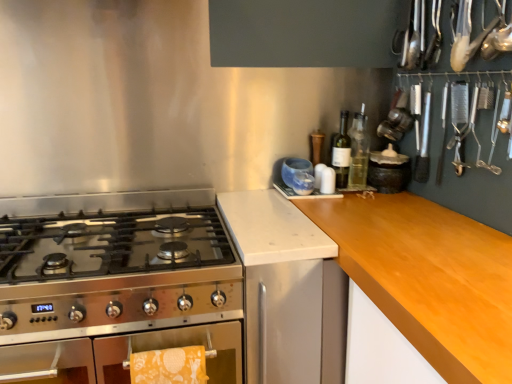
What is the approximate width of matte black jar at upper right?

4.41 inches.

In order to face matte black jar at upper right, should I rotate leftwards or rightwards?

Rotate right and turn 17.302 degrees.

This screenshot has height=384, width=512. I want to click on green glass bottle at upper right, which appears as the 1th bottle when viewed from the left, so coord(341,152).

What do you see at coordinates (117, 281) in the screenshot? The height and width of the screenshot is (384, 512). I see `stainless steel gas stove at left` at bounding box center [117, 281].

How much space does clear glass bottle at upper right, marked as the first bottle in a right-to-left arrangement, occupy horizontally?

It is 3.05 inches.

In order to face clear glass bottle at upper right, the 2th bottle in the left-to-right sequence, should I rotate leftwards or rightwards?

You should look right and rotate roughly 13.727 degrees.

What are the coordinates of `yellow printed towel at lower left` in the screenshot? It's located at (169, 366).

Is clear glass bottle at upper right, the 2th bottle in the left-to-right sequence, at the back of matte black jar at upper right?

Yes, matte black jar at upper right is facing away from clear glass bottle at upper right, the 2th bottle in the left-to-right sequence.

Would you say matte black jar at upper right is a long distance from clear glass bottle at upper right, marked as the first bottle in a right-to-left arrangement?

No, matte black jar at upper right is not far away from clear glass bottle at upper right, marked as the first bottle in a right-to-left arrangement.

From the image's perspective, is matte black jar at upper right positioned above or below clear glass bottle at upper right, marked as the first bottle in a right-to-left arrangement?

matte black jar at upper right is below clear glass bottle at upper right, marked as the first bottle in a right-to-left arrangement.

From a real-world perspective, count 1st bottles upward from the stainless steel gas stove at left and point to it. Please provide its 2D coordinates.

[(358, 152)]

Which is correct: stainless steel gas stove at left is inside clear glass bottle at upper right, the 2th bottle in the left-to-right sequence, or outside of it?

stainless steel gas stove at left lies outside clear glass bottle at upper right, the 2th bottle in the left-to-right sequence.

From a real-world perspective, is stainless steel gas stove at left above or below clear glass bottle at upper right, the 2th bottle in the left-to-right sequence?

stainless steel gas stove at left is below clear glass bottle at upper right, the 2th bottle in the left-to-right sequence.

Is point (224, 255) positioned after point (360, 186)?

No, it is not.

Is green glass bottle at upper right, which appears as the 1th bottle when viewed from the left, turned away from stainless steel gas stove at left?

No, green glass bottle at upper right, which appears as the 1th bottle when viewed from the left, is not facing the opposite direction of stainless steel gas stove at left.

From the picture: Can you confirm if green glass bottle at upper right, which appears as the 1th bottle when viewed from the left, is smaller than stainless steel gas stove at left?

Correct, green glass bottle at upper right, which appears as the 1th bottle when viewed from the left, occupies less space than stainless steel gas stove at left.

From a real-world perspective, who is located lower, green glass bottle at upper right, which appears as the 1th bottle when viewed from the left, or stainless steel gas stove at left?

stainless steel gas stove at left, from a real-world perspective.

Looking at this image, is green glass bottle at upper right, the second bottle positioned from the right, positioned behind stainless steel gas stove at left?

Yes, it is behind stainless steel gas stove at left.

Considering the relative positions of matte black jar at upper right and green glass bottle at upper right, the second bottle positioned from the right, in the image provided, is matte black jar at upper right to the left of green glass bottle at upper right, the second bottle positioned from the right, from the viewer's perspective?

No.

How far apart are matte black jar at upper right and green glass bottle at upper right, which appears as the 1th bottle when viewed from the left?

The distance of matte black jar at upper right from green glass bottle at upper right, which appears as the 1th bottle when viewed from the left, is 5.86 inches.

Is matte black jar at upper right positioned before green glass bottle at upper right, which appears as the 1th bottle when viewed from the left?

No, it is not.

Is matte black jar at upper right wider than green glass bottle at upper right, the second bottle positioned from the right?

Yes.

From a real-world perspective, which object rests below the other?

yellow printed towel at lower left is physically lower.

The image size is (512, 384). Identify the location of hand towel on the left side of green glass bottle at upper right, which appears as the 1th bottle when viewed from the left. (169, 366).

Who is bigger, green glass bottle at upper right, which appears as the 1th bottle when viewed from the left, or yellow printed towel at lower left?

Bigger between the two is yellow printed towel at lower left.

Is point (347, 163) positioned before point (177, 358)?

No, it is not.

From the image's perspective, is yellow printed towel at lower left located above or below green glass bottle at upper right, which appears as the 1th bottle when viewed from the left?

From the image's perspective, yellow printed towel at lower left appears below green glass bottle at upper right, which appears as the 1th bottle when viewed from the left.

Which point is more forward, (172, 348) or (344, 114)?

The point (172, 348) is closer.

Is yellow printed towel at lower left spatially inside green glass bottle at upper right, the second bottle positioned from the right, or outside of it?

yellow printed towel at lower left is located beyond the bounds of green glass bottle at upper right, the second bottle positioned from the right.

From the image's perspective, count 1st bottles upward from the yellow printed towel at lower left and point to it. Please provide its 2D coordinates.

[(341, 152)]

Could you tell me if clear glass bottle at upper right, marked as the first bottle in a right-to-left arrangement, is turned towards yellow printed towel at lower left?

No, clear glass bottle at upper right, marked as the first bottle in a right-to-left arrangement, is not aimed at yellow printed towel at lower left.

Is clear glass bottle at upper right, marked as the first bottle in a right-to-left arrangement, not within yellow printed towel at lower left?

Yes, clear glass bottle at upper right, marked as the first bottle in a right-to-left arrangement, is outside of yellow printed towel at lower left.

Which of these two, clear glass bottle at upper right, marked as the first bottle in a right-to-left arrangement, or yellow printed towel at lower left, is wider?

clear glass bottle at upper right, marked as the first bottle in a right-to-left arrangement, is wider.

How far apart are clear glass bottle at upper right, the 2th bottle in the left-to-right sequence, and yellow printed towel at lower left?

clear glass bottle at upper right, the 2th bottle in the left-to-right sequence, is 36.23 inches from yellow printed towel at lower left.

You are a GUI agent. You are given a task and a screenshot of the screen. Output one action in this format:
    pyautogui.click(x=<x>, y=<y>)
    Task: Click on the 1st bottle to the left when counting from the matte black jar at upper right
    
    Given the screenshot: What is the action you would take?
    pyautogui.click(x=358, y=152)

I want to click on the 2nd bottle to the right when counting from the stainless steel gas stove at left, so click(358, 152).

Based on their spatial positions, is stainless steel gas stove at left or green glass bottle at upper right, which appears as the 1th bottle when viewed from the left, further from clear glass bottle at upper right, the 2th bottle in the left-to-right sequence?

stainless steel gas stove at left is further to clear glass bottle at upper right, the 2th bottle in the left-to-right sequence.

Which object lies nearer to the anchor point green glass bottle at upper right, which appears as the 1th bottle when viewed from the left, clear glass bottle at upper right, marked as the first bottle in a right-to-left arrangement, or yellow printed towel at lower left?

clear glass bottle at upper right, marked as the first bottle in a right-to-left arrangement, is closer to green glass bottle at upper right, which appears as the 1th bottle when viewed from the left.

When comparing their distances from stainless steel gas stove at left, does green glass bottle at upper right, the second bottle positioned from the right, or clear glass bottle at upper right, marked as the first bottle in a right-to-left arrangement, seem further?

Among the two, clear glass bottle at upper right, marked as the first bottle in a right-to-left arrangement, is located further to stainless steel gas stove at left.

Looking at the image, which one is located further to yellow printed towel at lower left, clear glass bottle at upper right, marked as the first bottle in a right-to-left arrangement, or matte black jar at upper right?

matte black jar at upper right.

Considering their positions, is clear glass bottle at upper right, the 2th bottle in the left-to-right sequence, positioned further to matte black jar at upper right than yellow printed towel at lower left?

yellow printed towel at lower left.

From the image, which object appears to be farther from stainless steel gas stove at left, yellow printed towel at lower left or clear glass bottle at upper right, marked as the first bottle in a right-to-left arrangement?

The object further to stainless steel gas stove at left is clear glass bottle at upper right, marked as the first bottle in a right-to-left arrangement.

From the image, which object appears to be nearer to green glass bottle at upper right, the second bottle positioned from the right, matte black jar at upper right or yellow printed towel at lower left?

matte black jar at upper right.

From the picture: Looking at the image, which one is located closer to stainless steel gas stove at left, green glass bottle at upper right, which appears as the 1th bottle when viewed from the left, or matte black jar at upper right?

The object closer to stainless steel gas stove at left is green glass bottle at upper right, which appears as the 1th bottle when viewed from the left.

This screenshot has width=512, height=384. I want to click on bottle between green glass bottle at upper right, which appears as the 1th bottle when viewed from the left, and matte black jar at upper right, so click(358, 152).

Locate an element on the screen. This screenshot has width=512, height=384. kitchen appliance between green glass bottle at upper right, the second bottle positioned from the right, and yellow printed towel at lower left, in the vertical direction is located at coordinates (389, 172).

Where is `hand towel between stainless steel gas stove at left and matte black jar at upper right in the horizontal direction`? hand towel between stainless steel gas stove at left and matte black jar at upper right in the horizontal direction is located at coordinates (169, 366).

Identify the location of hand towel between stainless steel gas stove at left and clear glass bottle at upper right, marked as the first bottle in a right-to-left arrangement. (169, 366).